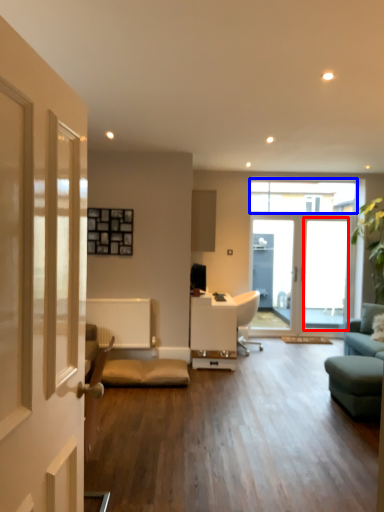
Question: Which point is further to the camera, window screen (highlighted by a red box) or window (highlighted by a blue box)?

Choices:
 (A) window screen
 (B) window

Answer: (B)